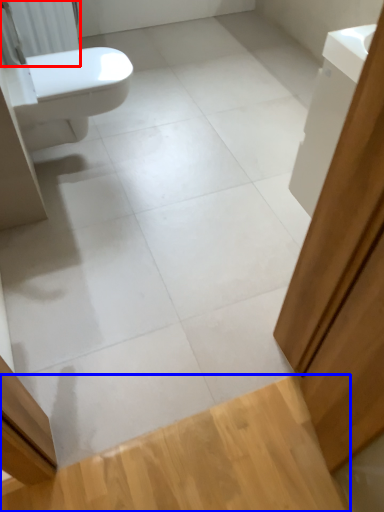
Question: Which point is closer to the camera, radiator (highlighted by a red box) or plank (highlighted by a blue box)?

Choices:
 (A) radiator
 (B) plank

Answer: (B)